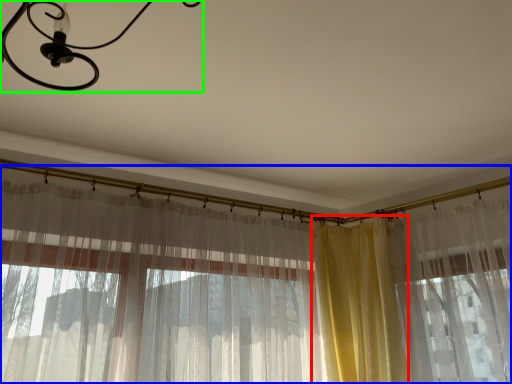
Question: Which object is positioned farthest from curtain (highlighted by a red box)? Select from curtain (highlighted by a blue box) and light fixture (highlighted by a green box).

Choices:
 (A) curtain
 (B) light fixture

Answer: (B)